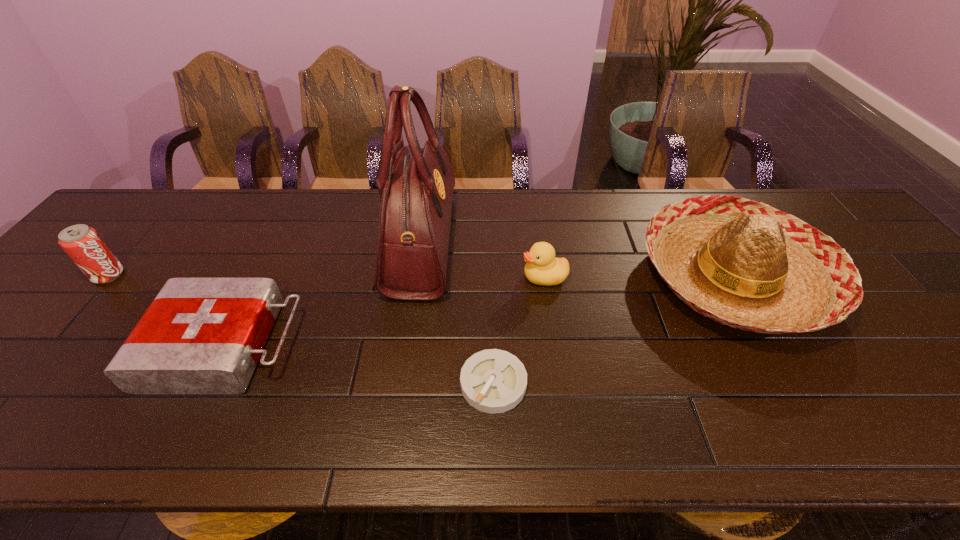
In order to click on the tallest object in this screenshot , I will do `click(416, 185)`.

Where is `the third object from left to right`? The image size is (960, 540). the third object from left to right is located at coordinates (416, 185).

At what (x,y) coordinates should I click in order to perform the action: click on the fifth shortest object. Please return your answer as a coordinate pair (x, y). Looking at the image, I should click on (742, 263).

Identify the location of sombrero. (742, 263).

At what (x,y) coordinates should I click in order to perform the action: click on the third tallest object. Please return your answer as a coordinate pair (x, y). The height and width of the screenshot is (540, 960). Looking at the image, I should click on (82, 243).

The width and height of the screenshot is (960, 540). I want to click on the leftmost object, so click(82, 243).

Locate an element on the screen. Image resolution: width=960 pixels, height=540 pixels. the fifth object from left to right is located at coordinates (542, 268).

In order to click on the third shortest object in this screenshot , I will do `click(542, 268)`.

Find the location of a particular element. the second shortest object is located at coordinates (200, 335).

The image size is (960, 540). I want to click on the fifth object from right to left, so click(200, 335).